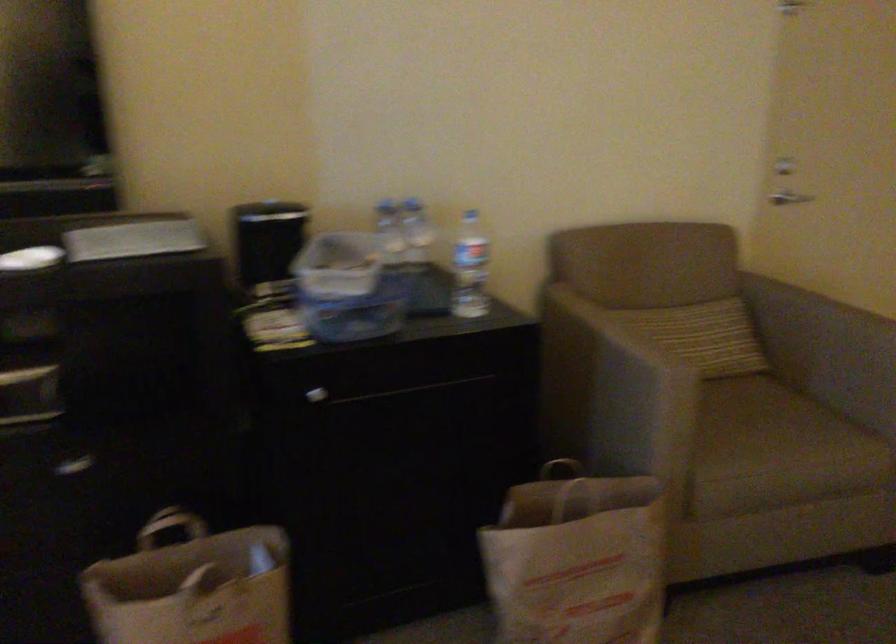
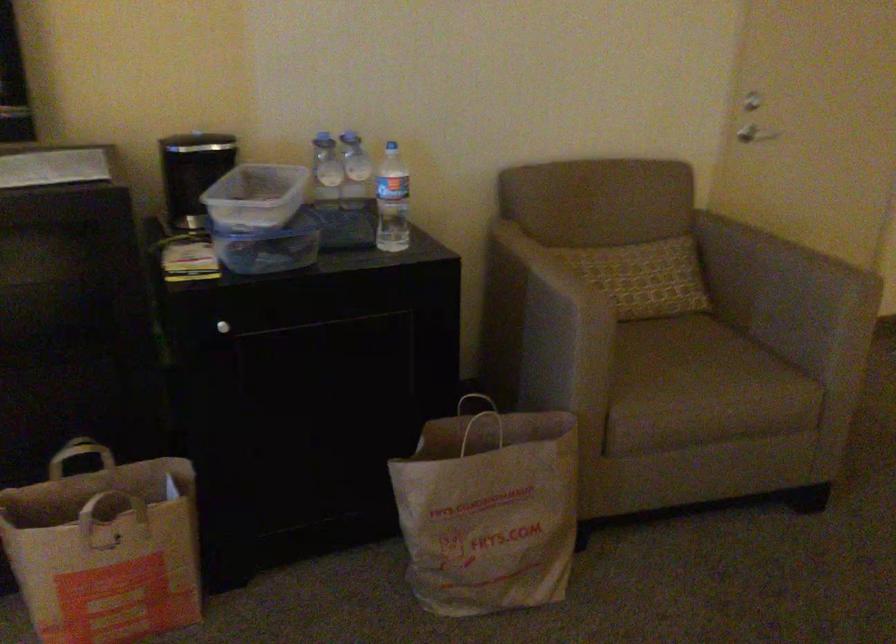
Locate, in the second image, the point that corresponds to (358,314) in the first image.

(269, 245)